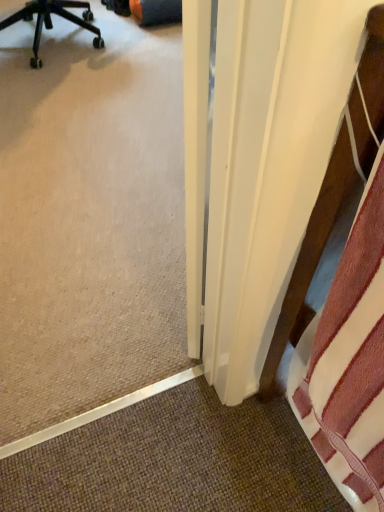
The height and width of the screenshot is (512, 384). What do you see at coordinates (309, 259) in the screenshot?
I see `white striped fabric at right` at bounding box center [309, 259].

The height and width of the screenshot is (512, 384). I want to click on white striped fabric at right, so (309, 259).

In order to face white striped fabric at right, should I rotate leftwards or rightwards?

A 24.600 degree turn to the right will do.

Locate an element on the screen. white striped fabric at right is located at coordinates (309, 259).